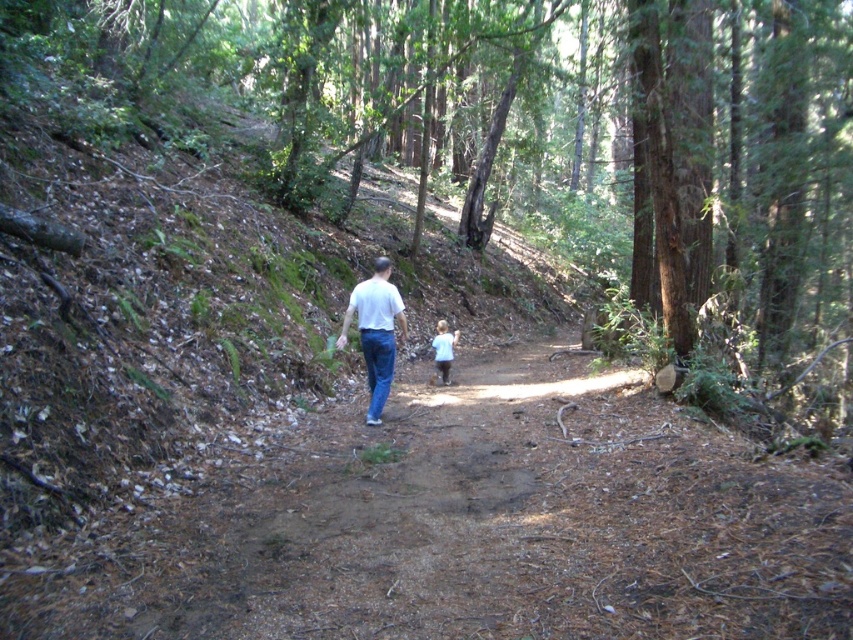
You are a hiker wearing a white matte shirt at center and have light brown hair at center. You want to take a photo of yourself holding a map to navigate the forest. To ensure both your shirt and hair are visible in the frame, which side of the path should you stand on?

You should stand on the right side of the path. Since the white matte shirt at center is positioned on the left side of light brown hair at center, standing on the right side will keep both elements in view without obstruction from the steep incline on the left.

You are a hiker wearing a white matte shirt at center and have light brown hair at center. You want to take a photo of yourself using a selfie stick. Which part of your body should you hold the selfie stick to ensure your entire torso and head are visible in the frame?

The white matte shirt at center is taller than the light brown hair at center, so you should hold the selfie stick at the white matte shirt at center to ensure your entire torso and head are visible in the frame.

You are a hiker trying to navigate through the forest path. You see your blue denim jeans at center. Where exactly are they positioned relative to the path?

The blue denim jeans at center are located at coordinates point (x=376, y=368), which places them near the center of the path.